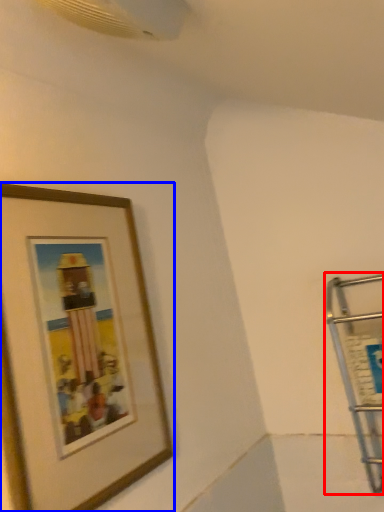
Question: Which point is closer to the camera, cart (highlighted by a red box) or picture frame (highlighted by a blue box)?

Choices:
 (A) cart
 (B) picture frame

Answer: (B)